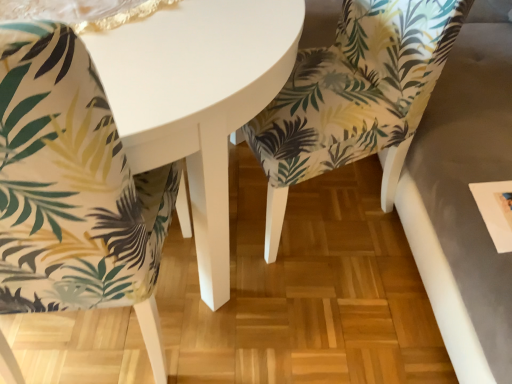
Describe the element at coordinates (197, 99) in the screenshot. This screenshot has width=512, height=384. I see `white glossy table at center` at that location.

Where is `white glossy table at center`? This screenshot has width=512, height=384. white glossy table at center is located at coordinates (197, 99).

Considering the positions of objects printed fabric chair at center, which is the 1th chair from right to left, and palm-patterned fabric chair at lower left, arranged as the first chair when viewed from the left, in the image provided, who is behind, printed fabric chair at center, which is the 1th chair from right to left, or palm-patterned fabric chair at lower left, arranged as the first chair when viewed from the left,?

printed fabric chair at center, which is the 1th chair from right to left, is more distant.

Where is `chair above the printed fabric chair at center, which is the 1th chair from right to left (from a real-world perspective)`? The height and width of the screenshot is (384, 512). chair above the printed fabric chair at center, which is the 1th chair from right to left (from a real-world perspective) is located at coordinates (72, 187).

Could you tell me if printed fabric chair at center, marked as the second chair in a left-to-right arrangement, is turned towards white glossy table at center?

Yes, printed fabric chair at center, marked as the second chair in a left-to-right arrangement, is facing white glossy table at center.

Based on the photo, considering the sizes of printed fabric chair at center, which is the 1th chair from right to left, and white glossy table at center in the image, is printed fabric chair at center, which is the 1th chair from right to left, taller or shorter than white glossy table at center?

Clearly, printed fabric chair at center, which is the 1th chair from right to left, is taller compared to white glossy table at center.

How different are the orientations of printed fabric chair at center, marked as the second chair in a left-to-right arrangement, and white glossy table at center in degrees?

The facing directions of printed fabric chair at center, marked as the second chair in a left-to-right arrangement, and white glossy table at center are 20.7 degrees apart.

Considering the points (286, 90) and (193, 148), which point is behind, point (286, 90) or point (193, 148)?

Positioned behind is point (286, 90).

From a real-world perspective, is white glossy table at center located beneath printed fabric chair at center, marked as the second chair in a left-to-right arrangement?

Yes, from a real-world perspective, white glossy table at center is below printed fabric chair at center, marked as the second chair in a left-to-right arrangement.

How many degrees apart are the facing directions of white glossy table at center and printed fabric chair at center, marked as the second chair in a left-to-right arrangement?

There is a 20.7-degree angle between the facing directions of white glossy table at center and printed fabric chair at center, marked as the second chair in a left-to-right arrangement.

Is white glossy table at center bigger or smaller than printed fabric chair at center, marked as the second chair in a left-to-right arrangement?

Clearly, white glossy table at center is larger in size than printed fabric chair at center, marked as the second chair in a left-to-right arrangement.

Which object is further away from the camera taking this photo, white glossy table at center or printed fabric chair at center, marked as the second chair in a left-to-right arrangement?

printed fabric chair at center, marked as the second chair in a left-to-right arrangement.

Does palm-patterned fabric chair at lower left, arranged as the first chair when viewed from the left, have a lesser height compared to white glossy table at center?

Incorrect, the height of palm-patterned fabric chair at lower left, arranged as the first chair when viewed from the left, does not fall short of that of white glossy table at center.

Based on the photo, from the image's perspective, is palm-patterned fabric chair at lower left, marked as the 2th chair in a right-to-left arrangement, beneath white glossy table at center?

Yes.

Which object is thinner, palm-patterned fabric chair at lower left, arranged as the first chair when viewed from the left, or white glossy table at center?

Thinner between the two is palm-patterned fabric chair at lower left, arranged as the first chair when viewed from the left.

Between white glossy table at center and palm-patterned fabric chair at lower left, arranged as the first chair when viewed from the left, which one has more height?

palm-patterned fabric chair at lower left, arranged as the first chair when viewed from the left.

How much distance is there between white glossy table at center and palm-patterned fabric chair at lower left, marked as the 2th chair in a right-to-left arrangement?

They are 20.59 centimeters apart.

Based on the photo, between white glossy table at center and palm-patterned fabric chair at lower left, marked as the 2th chair in a right-to-left arrangement, which one appears on the left side from the viewer's perspective?

white glossy table at center.

Does point (182, 122) come behind point (96, 107)?

Yes, it is behind point (96, 107).

Which is nearer, (x=28, y=87) or (x=379, y=31)?

Point (x=28, y=87) is positioned closer to the camera compared to point (x=379, y=31).

Between palm-patterned fabric chair at lower left, marked as the 2th chair in a right-to-left arrangement, and printed fabric chair at center, which is the 1th chair from right to left, which one has larger size?

palm-patterned fabric chair at lower left, marked as the 2th chair in a right-to-left arrangement.

Considering the relative sizes of palm-patterned fabric chair at lower left, arranged as the first chair when viewed from the left, and printed fabric chair at center, marked as the second chair in a left-to-right arrangement, in the image provided, is palm-patterned fabric chair at lower left, arranged as the first chair when viewed from the left, taller than printed fabric chair at center, marked as the second chair in a left-to-right arrangement,?

Yes, palm-patterned fabric chair at lower left, arranged as the first chair when viewed from the left, is taller than printed fabric chair at center, marked as the second chair in a left-to-right arrangement.

Considering the sizes of palm-patterned fabric chair at lower left, arranged as the first chair when viewed from the left, and printed fabric chair at center, which is the 1th chair from right to left, in the image, is palm-patterned fabric chair at lower left, arranged as the first chair when viewed from the left, wider or thinner than printed fabric chair at center, which is the 1th chair from right to left,?

In the image, palm-patterned fabric chair at lower left, arranged as the first chair when viewed from the left, appears to be more narrow than printed fabric chair at center, which is the 1th chair from right to left.

The width and height of the screenshot is (512, 384). What are the coordinates of `chair located on the left of printed fabric chair at center, marked as the second chair in a left-to-right arrangement` in the screenshot? It's located at (72, 187).

From a real-world perspective, starting from the white glossy table at center, which chair is the 1st one vertically above it? Please provide its 2D coordinates.

[(354, 97)]

Which object lies further to the anchor point white glossy table at center, palm-patterned fabric chair at lower left, marked as the 2th chair in a right-to-left arrangement, or printed fabric chair at center, which is the 1th chair from right to left?

Among the two, printed fabric chair at center, which is the 1th chair from right to left, is located further to white glossy table at center.

When comparing their distances from printed fabric chair at center, marked as the second chair in a left-to-right arrangement, does palm-patterned fabric chair at lower left, arranged as the first chair when viewed from the left, or white glossy table at center seem closer?

Among the two, white glossy table at center is located nearer to printed fabric chair at center, marked as the second chair in a left-to-right arrangement.

Which object lies nearer to the anchor point palm-patterned fabric chair at lower left, arranged as the first chair when viewed from the left, white glossy table at center or printed fabric chair at center, which is the 1th chair from right to left?

Based on the image, white glossy table at center appears to be nearer to palm-patterned fabric chair at lower left, arranged as the first chair when viewed from the left.

Which object lies further to the anchor point palm-patterned fabric chair at lower left, marked as the 2th chair in a right-to-left arrangement, printed fabric chair at center, marked as the second chair in a left-to-right arrangement, or white glossy table at center?

printed fabric chair at center, marked as the second chair in a left-to-right arrangement, lies further to palm-patterned fabric chair at lower left, marked as the 2th chair in a right-to-left arrangement, than the other object.

Considering their positions, is white glossy table at center positioned closer to printed fabric chair at center, which is the 1th chair from right to left, than palm-patterned fabric chair at lower left, arranged as the first chair when viewed from the left?

white glossy table at center lies closer to printed fabric chair at center, which is the 1th chair from right to left, than the other object.

From the image, which object appears to be nearer to white glossy table at center, printed fabric chair at center, which is the 1th chair from right to left, or palm-patterned fabric chair at lower left, marked as the 2th chair in a right-to-left arrangement?

A: Based on the image, palm-patterned fabric chair at lower left, marked as the 2th chair in a right-to-left arrangement, appears to be nearer to white glossy table at center.

The image size is (512, 384). What are the coordinates of `chair situated between white glossy table at center and printed fabric chair at center, which is the 1th chair from right to left, from left to right` in the screenshot? It's located at (72, 187).